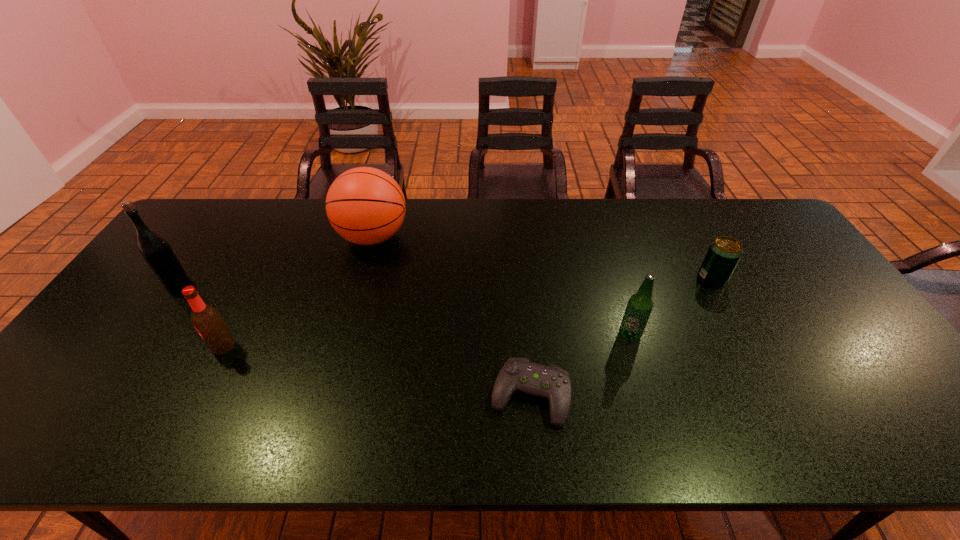
Identify the location of the tallest beer bottle. Image resolution: width=960 pixels, height=540 pixels. (157, 252).

Identify the location of the leftmost object. (157, 252).

This screenshot has height=540, width=960. In order to click on basketball in this screenshot , I will do `click(366, 206)`.

I want to click on the third object from left to right, so point(366,206).

Identify the location of the rightmost beer bottle. (640, 305).

This screenshot has width=960, height=540. I want to click on the second object from left to right, so click(x=207, y=320).

Locate an element on the screen. The width and height of the screenshot is (960, 540). the rightmost object is located at coordinates (724, 252).

I want to click on the second shortest object, so click(724, 252).

The height and width of the screenshot is (540, 960). What are the coordinates of `the fourth object from left to right` in the screenshot? It's located at (518, 374).

At what (x,y) coordinates should I click in order to perform the action: click on the shortest object. Please return your answer as a coordinate pair (x, y). The height and width of the screenshot is (540, 960). Looking at the image, I should click on (518, 374).